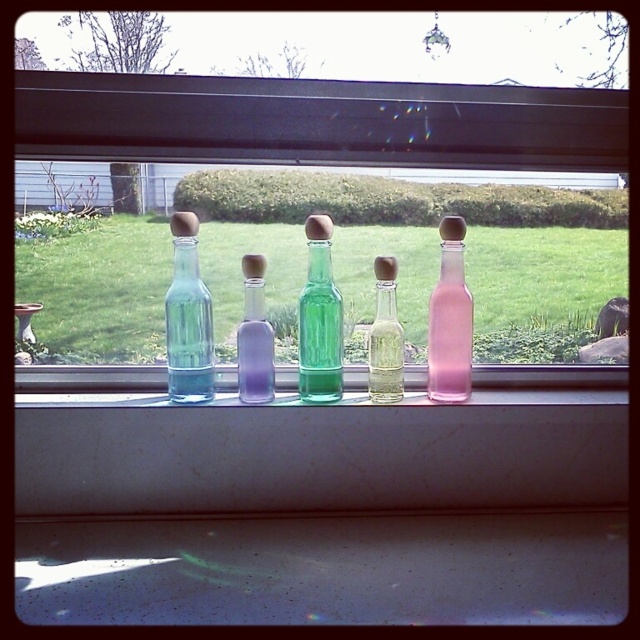
You are a visitor looking at the bottles on the windowsill. You notice the transparent glass bottles at center and the green glass bottle at center. Which one is larger in size?

The transparent glass bottles at center is bigger than green glass bottle at center.

Consider the image. You are standing in front of the window and see the transparent glass bottles at center and the green glass bottle at center. Which one is positioned to the left?

The transparent glass bottles at center is positioned to the left of the green glass bottle at center.